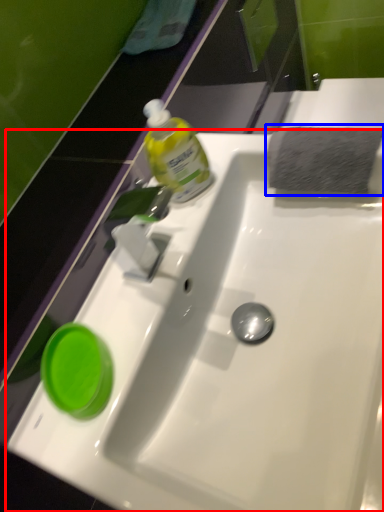
Question: Which point is closer to the camera, sink (highlighted by a red box) or hand towel (highlighted by a blue box)?

Choices:
 (A) sink
 (B) hand towel

Answer: (A)